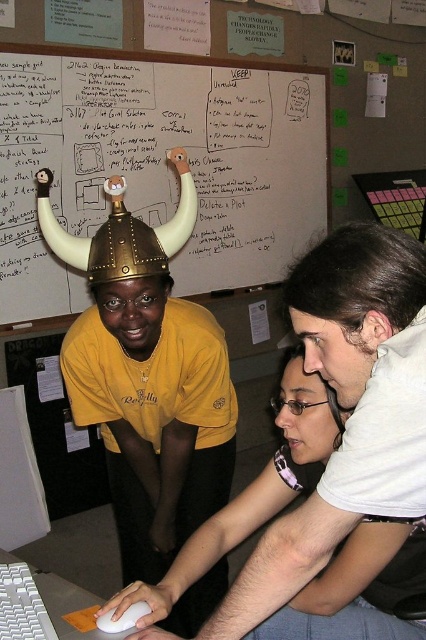
Is whiteboard at upper center thinner than matte black hair at center?

Incorrect, whiteboard at upper center's width is not less than matte black hair at center's.

Between whiteboard at upper center and matte black hair at center, which one is positioned lower?

matte black hair at center is below.

I want to click on whiteboard at upper center, so click(x=158, y=163).

Find the location of a particular element. The image size is (426, 640). white matte mouse at center is located at coordinates (252, 490).

Who is lower down, white matte mouse at center or white matte mouse at lower center?

white matte mouse at lower center is lower down.

Image resolution: width=426 pixels, height=640 pixels. In order to click on white matte mouse at center in this screenshot , I will do `click(252, 490)`.

Does brown hair at center have a greater height compared to white matte mouse at lower center?

Indeed, brown hair at center has a greater height compared to white matte mouse at lower center.

Is point (348, 305) closer to viewer compared to point (144, 611)?

Yes.

This screenshot has width=426, height=640. I want to click on brown hair at center, so click(354, 301).